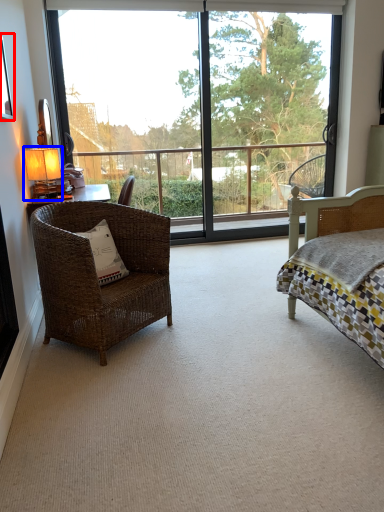
Question: Among these objects, which one is nearest to the camera, picture frame (highlighted by a red box) or table lamp (highlighted by a blue box)?

Choices:
 (A) picture frame
 (B) table lamp

Answer: (A)